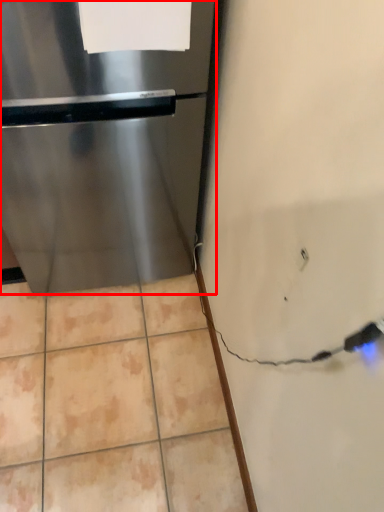
Question: Considering the relative positions of refrigerator (annotated by the red box) and paper in the image provided, where is refrigerator (annotated by the red box) located with respect to the staircase?

Choices:
 (A) right
 (B) left

Answer: (B)